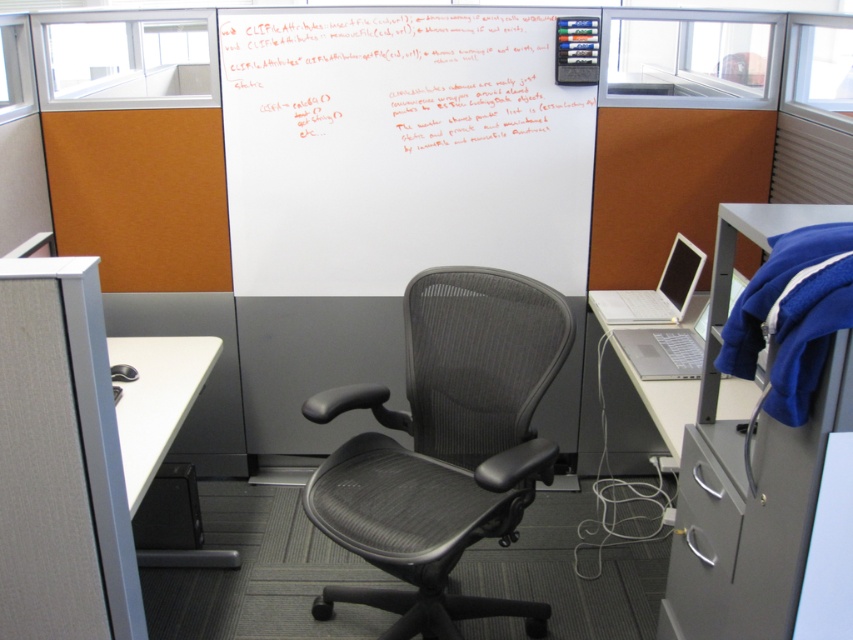
Question: From the image, what is the correct spatial relationship of black mesh swivel chair at center in relation to white matte table at lower left?

Choices:
 (A) left
 (B) right

Answer: (B)

Question: Which of these objects is positioned closest to the silver metallic laptop at right?

Choices:
 (A) whiteboard at upper center
 (B) white matte dry erase board at upper center
 (C) white matte table at lower left
 (D) black mesh swivel chair at center

Answer: (D)

Question: Is whiteboard at upper center positioned in front of gray metallic file cabinet at right?

Choices:
 (A) no
 (B) yes

Answer: (A)

Question: Is white matte dry erase board at upper center to the left of silver metallic laptop at right from the viewer's perspective?

Choices:
 (A) no
 (B) yes

Answer: (B)

Question: Based on their relative distances, which object is nearer to the whiteboard at upper center?

Choices:
 (A) gray metallic file cabinet at right
 (B) silver metallic laptop at right
 (C) white matte dry erase board at upper center
 (D) black mesh swivel chair at center

Answer: (C)

Question: Among these objects, which one is farthest from the camera?

Choices:
 (A) black mesh swivel chair at center
 (B) gray metallic file cabinet at right

Answer: (A)